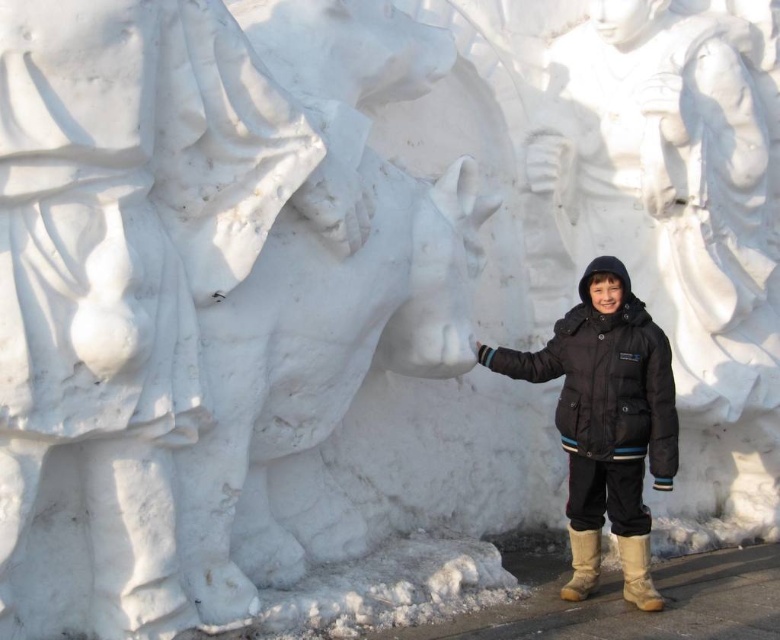
Question: Which object is the closest to the white marble statue at center?

Choices:
 (A) black matte jacket at center
 (B) tan suede boot at lower right

Answer: (A)

Question: Can you confirm if black matte jacket at center is smaller than brown suede boot at lower right?

Choices:
 (A) no
 (B) yes

Answer: (A)

Question: Is white marble statue at center above black matte jacket at center?

Choices:
 (A) yes
 (B) no

Answer: (A)

Question: Is tan suede boot at lower right below brown suede boot at lower right?

Choices:
 (A) yes
 (B) no

Answer: (B)

Question: Among these objects, which one is farthest from the camera?

Choices:
 (A) white marble statue at center
 (B) tan suede boot at lower right
 (C) brown suede boot at lower right
 (D) black matte jacket at center

Answer: (A)

Question: Considering the real-world distances, which object is farthest from the white marble statue at center?

Choices:
 (A) brown suede boot at lower right
 (B) tan suede boot at lower right
 (C) black matte jacket at center

Answer: (A)